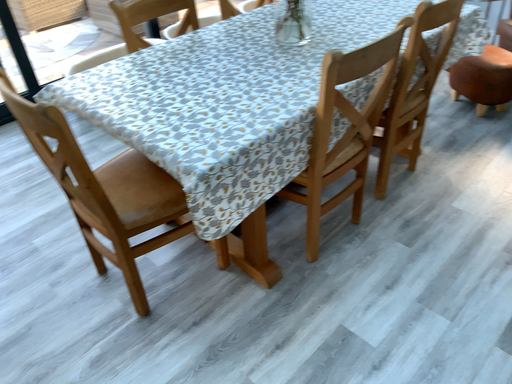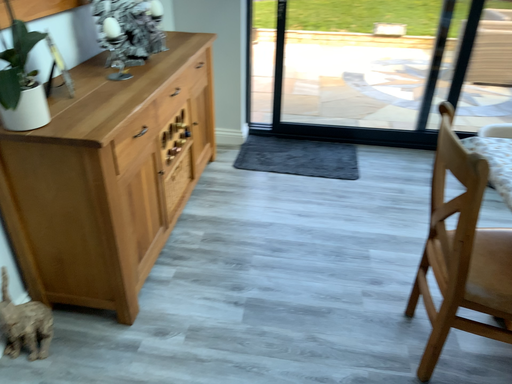
Question: Which way did the camera rotate in the video?

Choices:
 (A) rotated right
 (B) rotated left

Answer: (B)